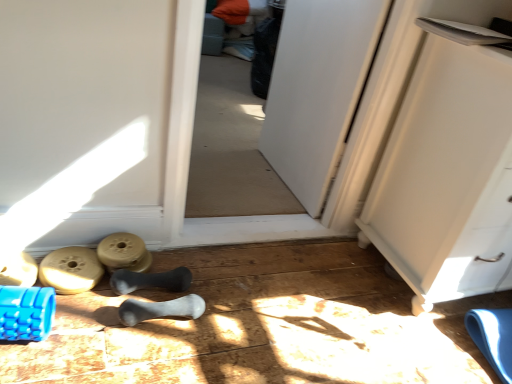
Question: Is matte plastic weight at lower center, the 2th job from the front, bigger or smaller than blue textured foam roller at lower left, the 1th job from the left?

Choices:
 (A) big
 (B) small

Answer: (B)

Question: From the image's perspective, is matte plastic weight at lower center, the second job positioned from the left, above or below blue textured foam roller at lower left, positioned as the 2th job in right-to-left order?

Choices:
 (A) above
 (B) below

Answer: (A)

Question: Which of these objects is positioned farthest from the white matte cabinet at right?

Choices:
 (A) gray rubber bone at center, arranged as the first footwear when viewed from the right
 (B) blue rubber roller at lower left, placed as the 1th footwear when sorted from left to right
 (C) matte rubber dumbbell at lower left, the 2th footwear when ordered from left to right
 (D) blue textured foam roller at lower left, acting as the second job starting from the back
 (E) matte plastic weight at lower center, the 2th job from the front

Answer: (B)

Question: Estimate the real-world distances between objects in this image. Which object is farther from the white matte cabinet at right?

Choices:
 (A) gray rubber bone at center, positioned as the 2th footwear in right-to-left order
 (B) blue rubber roller at lower left, placed as the 1th footwear when sorted from left to right
 (C) matte plastic weight at lower center, placed as the 1th job when sorted from back to front
 (D) gray rubber bone at center, arranged as the 4th footwear when viewed from the left
 (E) blue textured foam roller at lower left, the 1th job from the left

Answer: (B)